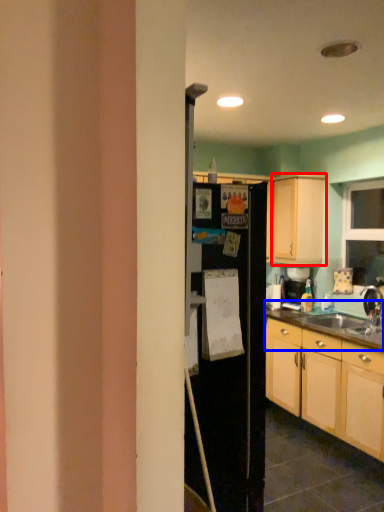
Question: Which object is closer to the camera taking this photo, cabinetry (highlighted by a red box) or countertop (highlighted by a blue box)?

Choices:
 (A) cabinetry
 (B) countertop

Answer: (B)